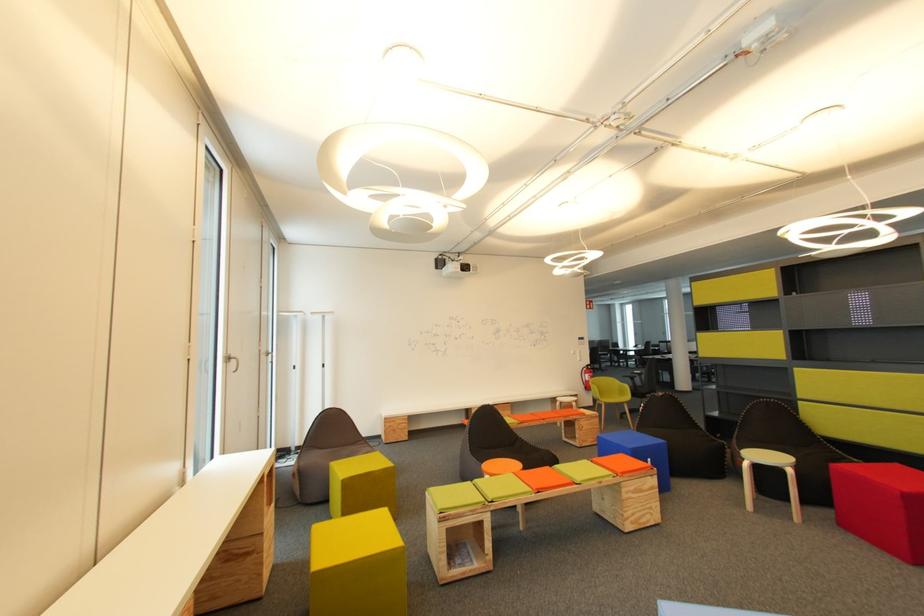
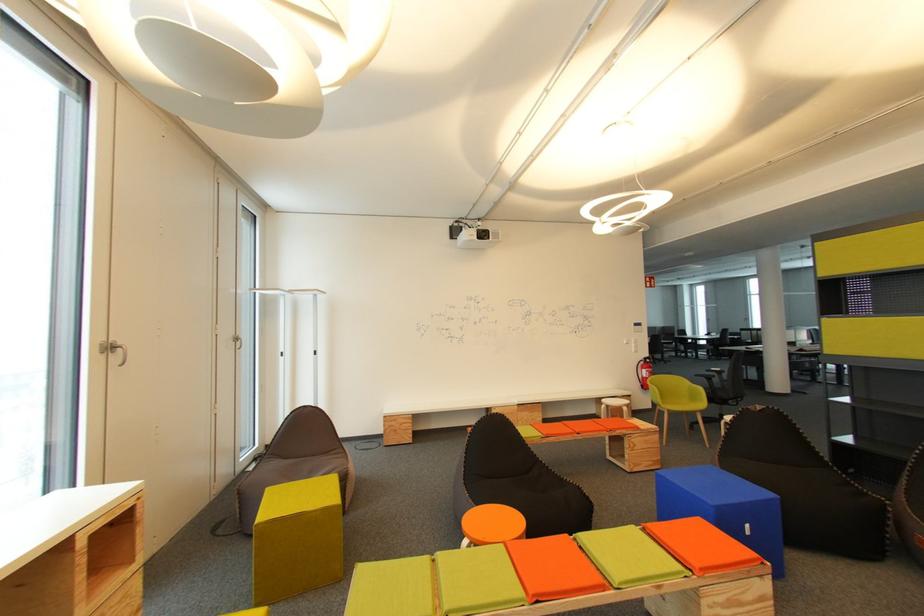
The images are taken continuously from a first-person perspective. In which direction are you moving?

The movement direction of the cameraman is right, forward.